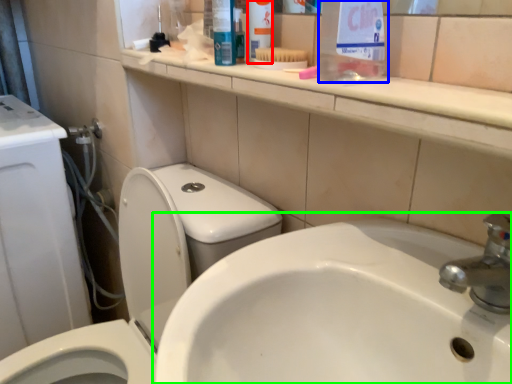
Question: Which object is the farthest from toiletry (highlighted by a red box)? Choose among these: cleaning product (highlighted by a blue box) or sink (highlighted by a green box).

Choices:
 (A) cleaning product
 (B) sink

Answer: (B)